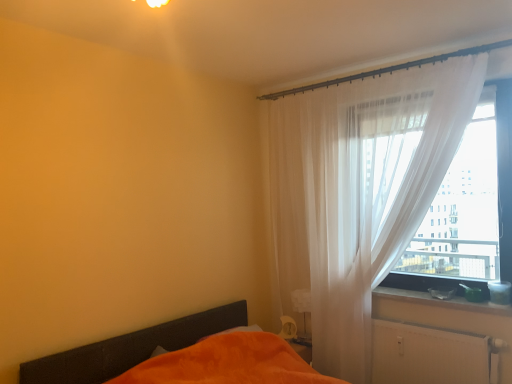
Question: In the image, is white sheer curtain at right positioned in front of or behind matte plastic container at right?

Choices:
 (A) behind
 (B) front

Answer: (B)

Question: Looking at the image, does white sheer curtain at right seem bigger or smaller compared to matte plastic container at right?

Choices:
 (A) small
 (B) big

Answer: (B)

Question: Considering the real-world distances, which object is farthest from the white matte radiator at lower right?

Choices:
 (A) white sheer curtain at right
 (B) orange fabric bed at lower left
 (C) transparent fabric at right
 (D) matte plastic container at right

Answer: (B)

Question: Which object is positioned closest to the white sheer curtain at right?

Choices:
 (A) white matte radiator at lower right
 (B) transparent fabric at right
 (C) orange fabric bed at lower left
 (D) matte plastic container at right

Answer: (B)